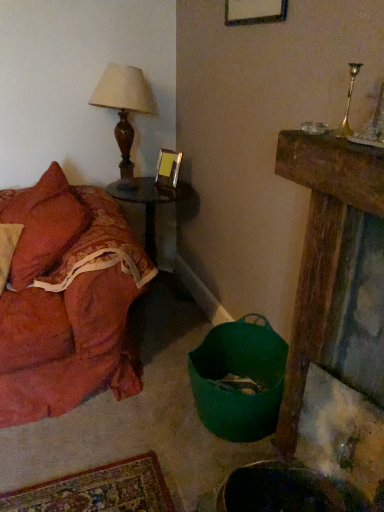
Question: Based on their positions, is matte brown wood table lamp at upper left located to the left or right of wooden side table at center?

Choices:
 (A) right
 (B) left

Answer: (B)

Question: Considering the positions of matte brown wood table lamp at upper left and wooden side table at center in the image, is matte brown wood table lamp at upper left wider or thinner than wooden side table at center?

Choices:
 (A) thin
 (B) wide

Answer: (A)

Question: Estimate the real-world distances between objects in this image. Which object is farther from the wooden side table at center?

Choices:
 (A) velvet orange couch at left
 (B) metallic gold picture frame at upper center
 (C) matte brown wood table lamp at upper left

Answer: (A)

Question: Which is nearer to the metallic gold picture frame at upper center?

Choices:
 (A) wooden side table at center
 (B) matte brown wood table lamp at upper left
 (C) velvet orange couch at left

Answer: (A)